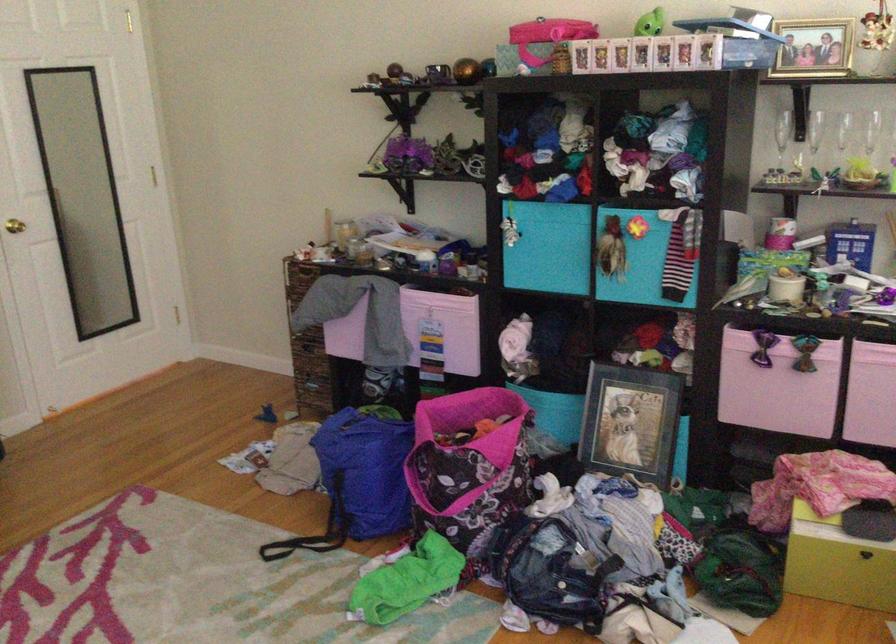
Where would you lift the light green box? Please return your answer as a coordinate pair (x, y).

(838, 563)